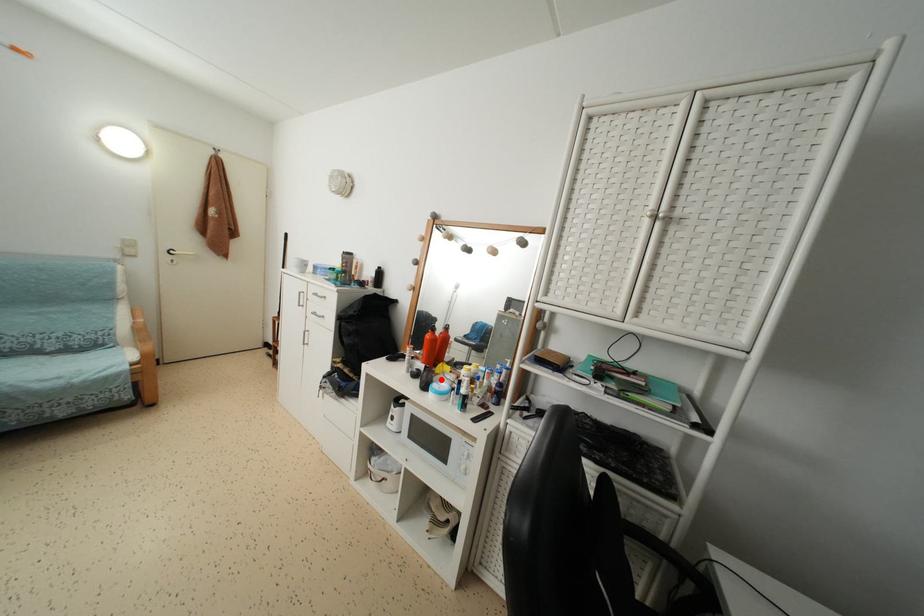
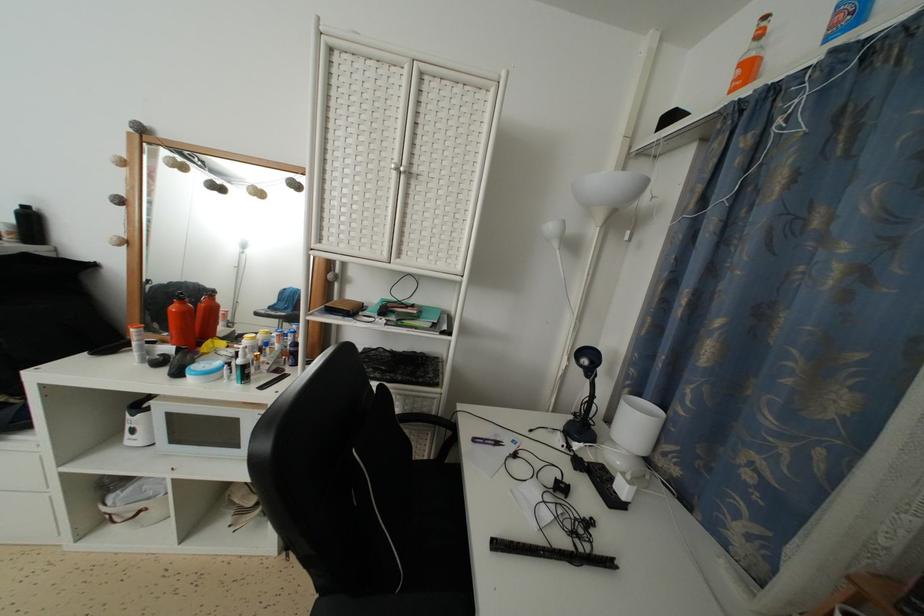
Where in the second image is the point corresponding to the highlighted location from the first image?

(209, 360)